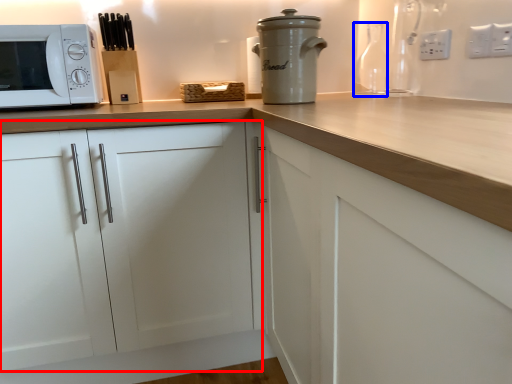
Question: Among these objects, which one is farthest to the camera, cabinetry (highlighted by a red box) or bottle (highlighted by a blue box)?

Choices:
 (A) cabinetry
 (B) bottle

Answer: (B)